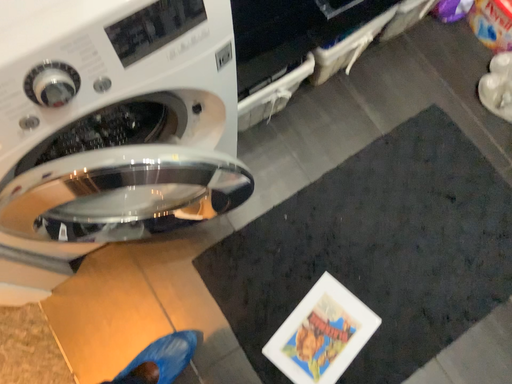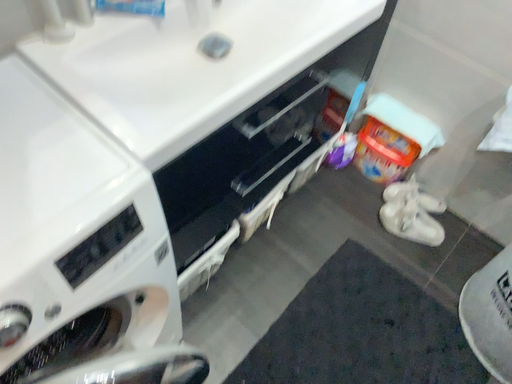
Question: Which way did the camera rotate in the video?

Choices:
 (A) rotated upward
 (B) rotated downward

Answer: (A)